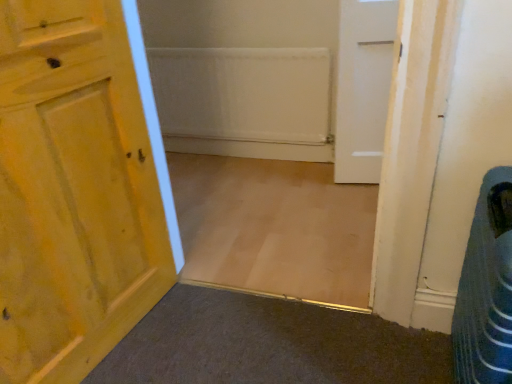
Image resolution: width=512 pixels, height=384 pixels. What are the coordinates of `vacant area that is situated to the right of wooden door at left, which is the 2th door in right-to-left order` in the screenshot? It's located at (213, 340).